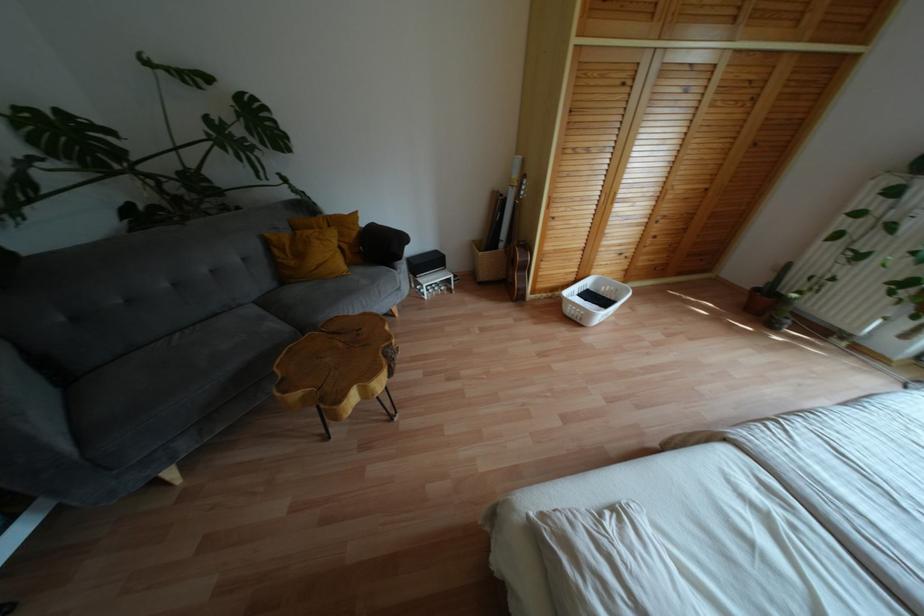
Where would you sit the chair sitting surface? Please return your answer as a coordinate pair (x, y).

(338, 368)